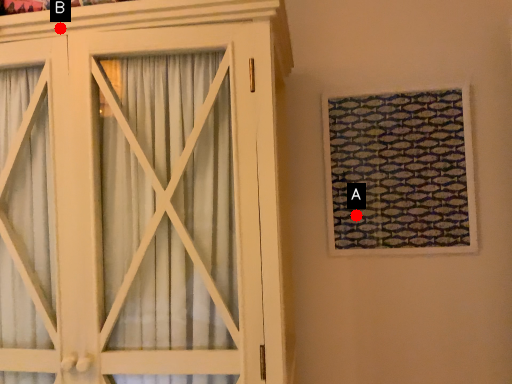
Question: Two points are circled on the image, labeled by A and B beside each circle. Which of the following is the closest to the observer?

Choices:
 (A) A is closer
 (B) B is closer

Answer: (B)